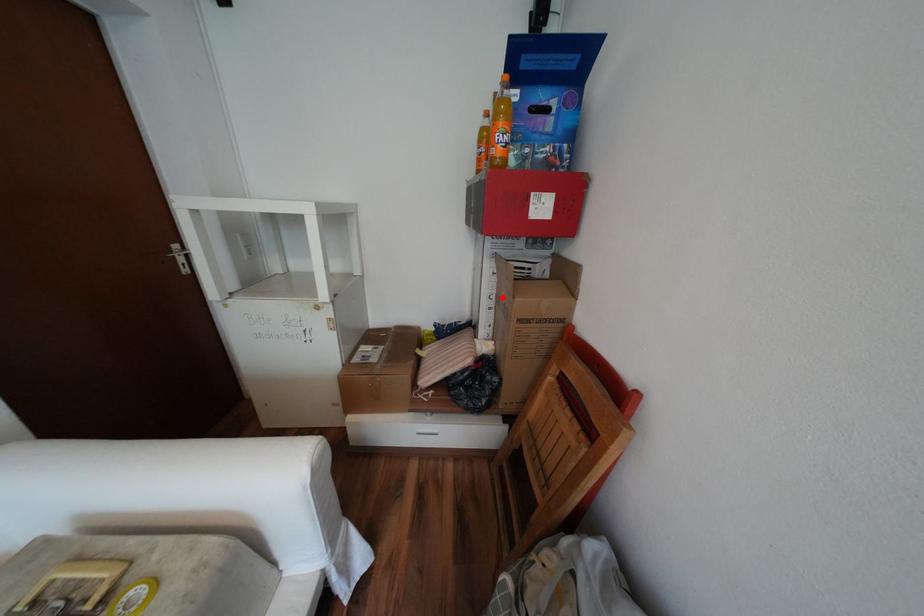
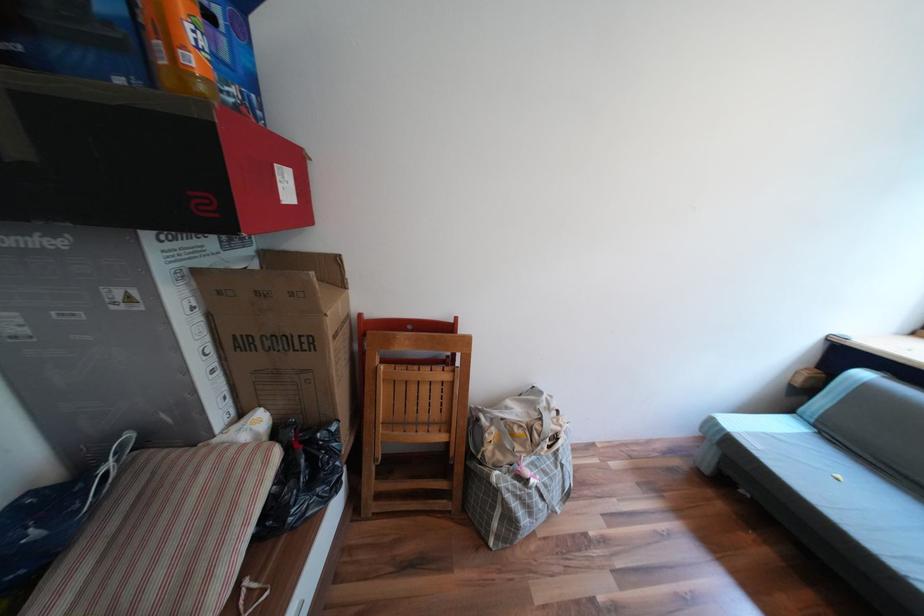
The point at the highlighted location is marked in the first image. Where is the corresponding point in the second image?

(219, 349)